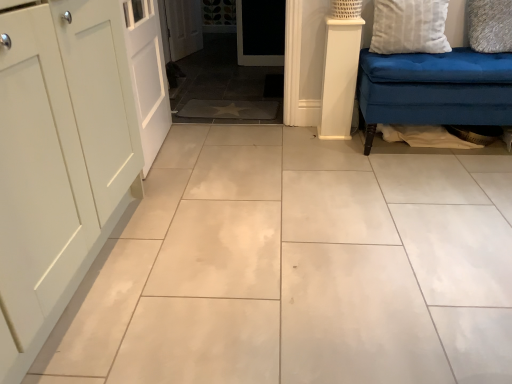
The image size is (512, 384). I want to click on free region on the left part of white smooth column at right, so click(304, 127).